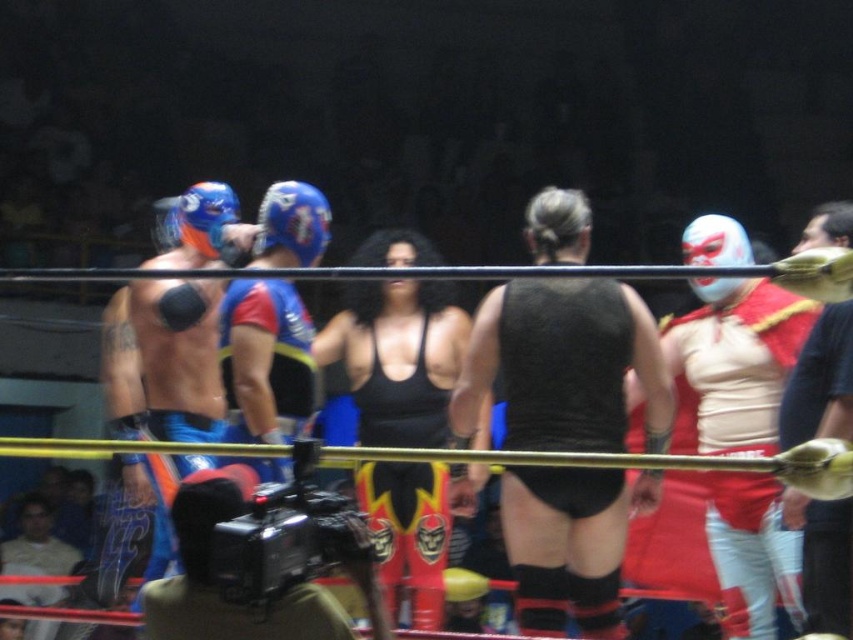
Based on the photo, you are a photographer trying to capture a clear shot of both the black matte vest at center and the matte white mask at center during the wrestling match. Since the camera is placed in front of the ring, which object should you focus on first to ensure both are in frame?

The black matte vest at center is positioned on the left side of the matte white mask at center. Therefore, you should focus on the matte white mask at center first, as it is on the right side and closer to the center of the frame, ensuring both objects remain in the shot.

You are a photographer standing at the center of the wrestling ring. You need to take a photo that includes both the point at [299,342] and the point at [306,611]. Which point should you position closer to the camera to ensure both are in frame?

To include both points in the frame, position the point at [306,611] closer to the camera since it is in front of point [299,342]. This way, the camera can capture both points without one being obscured by the other.

Where is the black matte vest at center located in the image?

The black matte vest at center is located at point coordinates of 0.572 on the x axis and 0.662 on the y axis.